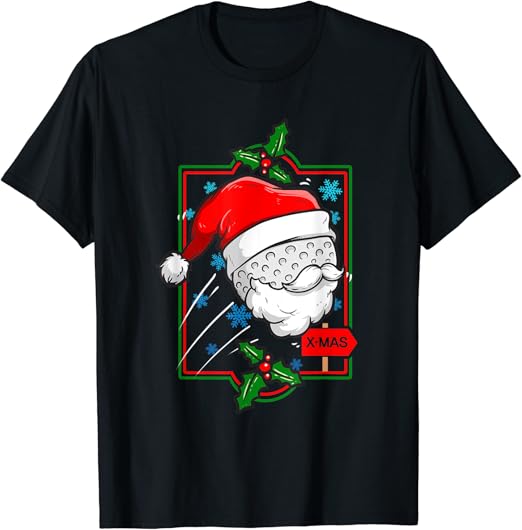
This screenshot has width=522, height=530. I want to click on tassel, so click(x=162, y=271).